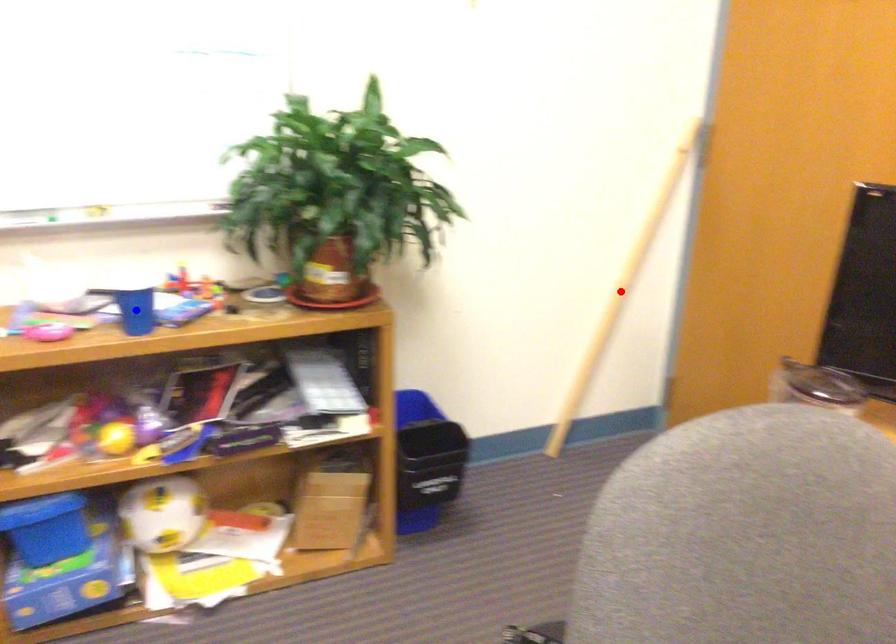
Question: In the image, two points are highlighted. Which point is nearer to the camera? Reply with the corresponding letter.

Choices:
 (A) blue point
 (B) red point

Answer: (A)